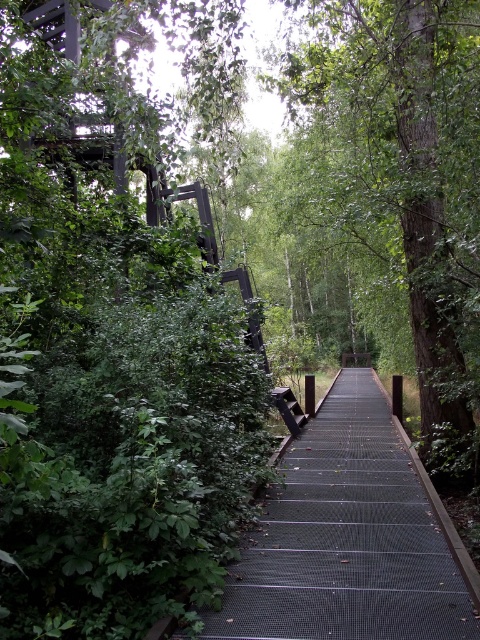
Question: Does green leafy tree at center have a lesser width compared to black mesh staircase at center?

Choices:
 (A) no
 (B) yes

Answer: (A)

Question: Which of the following is the farthest from the observer?

Choices:
 (A) (351, 612)
 (B) (464, 189)

Answer: (B)

Question: Is green leafy tree at center bigger than black mesh staircase at center?

Choices:
 (A) no
 (B) yes

Answer: (B)

Question: Is green leafy tree at center positioned before black mesh staircase at center?

Choices:
 (A) yes
 (B) no

Answer: (B)

Question: Which point is closer to the camera taking this photo?

Choices:
 (A) coord(412,326)
 (B) coord(251,616)

Answer: (B)